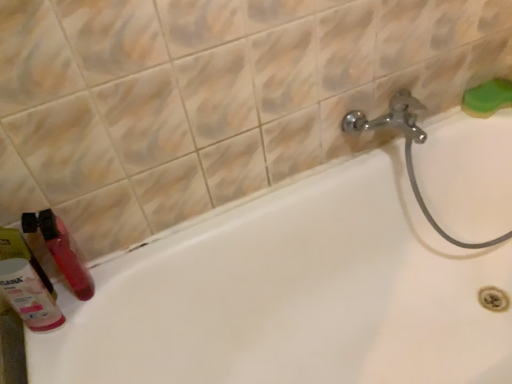
Question: Can you confirm if white glossy bathtub at lower left is positioned to the left of matte plastic toothbrush at lower left?

Choices:
 (A) no
 (B) yes

Answer: (A)

Question: Considering the relative sizes of white glossy bathtub at lower left and matte plastic toothbrush at lower left in the image provided, is white glossy bathtub at lower left thinner than matte plastic toothbrush at lower left?

Choices:
 (A) no
 (B) yes

Answer: (A)

Question: Does white glossy bathtub at lower left have a lesser height compared to matte plastic toothbrush at lower left?

Choices:
 (A) yes
 (B) no

Answer: (B)

Question: From the image's perspective, is white glossy bathtub at lower left on matte plastic toothbrush at lower left?

Choices:
 (A) no
 (B) yes

Answer: (A)

Question: Is white glossy bathtub at lower left not within matte plastic toothbrush at lower left?

Choices:
 (A) no
 (B) yes

Answer: (B)

Question: Can you confirm if white glossy bathtub at lower left is smaller than matte plastic toothbrush at lower left?

Choices:
 (A) yes
 (B) no

Answer: (B)

Question: Does white glossy bathtub at lower left contain matte pink bottle at lower left?

Choices:
 (A) no
 (B) yes

Answer: (A)

Question: Can you confirm if white glossy bathtub at lower left is smaller than matte pink bottle at lower left?

Choices:
 (A) yes
 (B) no

Answer: (B)

Question: Can you confirm if white glossy bathtub at lower left is bigger than matte pink bottle at lower left?

Choices:
 (A) no
 (B) yes

Answer: (B)

Question: Is white glossy bathtub at lower left oriented towards matte pink bottle at lower left?

Choices:
 (A) yes
 (B) no

Answer: (B)

Question: Considering the relative sizes of white glossy bathtub at lower left and matte pink bottle at lower left in the image provided, is white glossy bathtub at lower left wider than matte pink bottle at lower left?

Choices:
 (A) yes
 (B) no

Answer: (A)

Question: Are white glossy bathtub at lower left and matte pink bottle at lower left located far from each other?

Choices:
 (A) no
 (B) yes

Answer: (A)

Question: Is green sponge at upper right completely or partially outside of matte pink bottle at lower left?

Choices:
 (A) yes
 (B) no

Answer: (A)